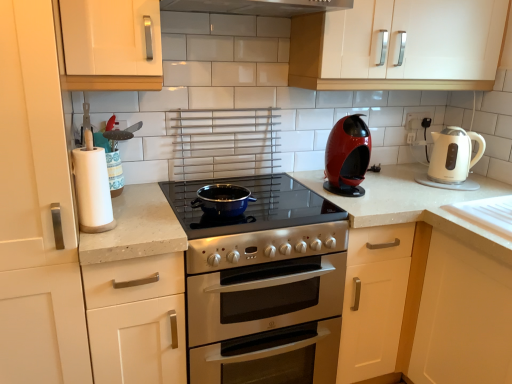
You are a GUI agent. You are given a task and a screenshot of the screen. Output one action in this format:
    pyautogui.click(x=<x>, y=<y>)
    Task: Click on the vacant location below white glossy electric kettle at right, positioned as the 2th kitchen appliance in left-to-right order (from a real-world perspective)
    This screenshot has width=512, height=384.
    Given the screenshot: What is the action you would take?
    pyautogui.click(x=444, y=183)